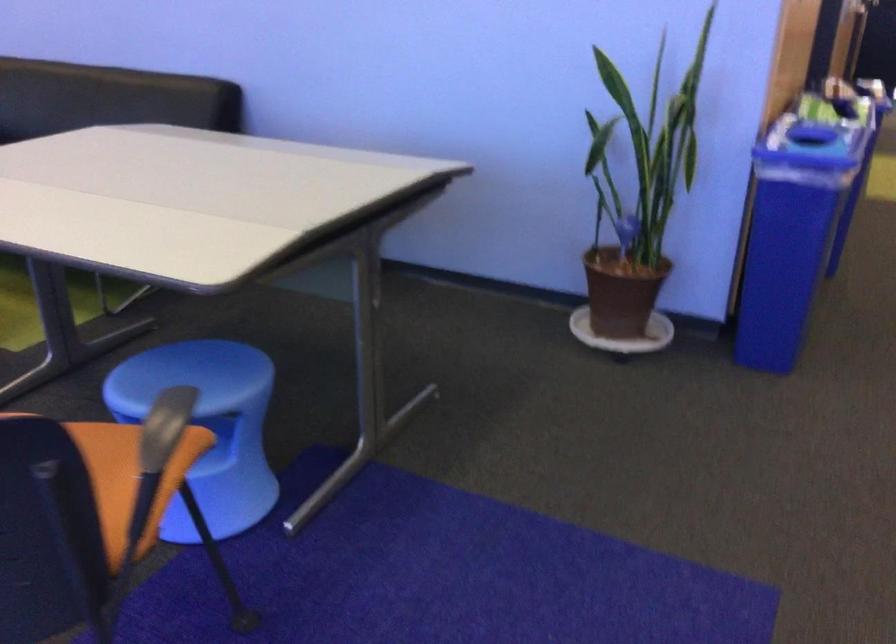
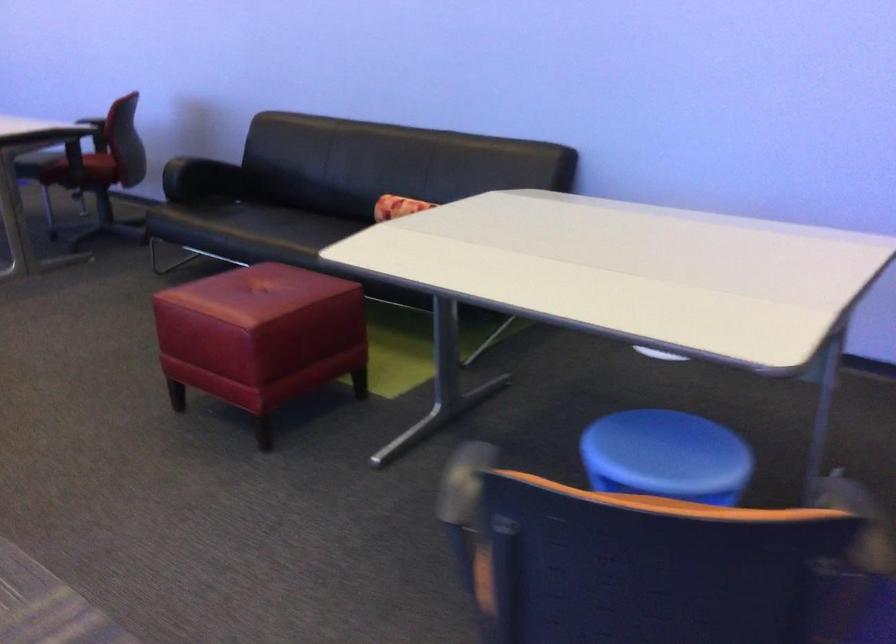
Locate, in the second image, the point that corresponds to (x=186, y=383) in the first image.

(666, 456)